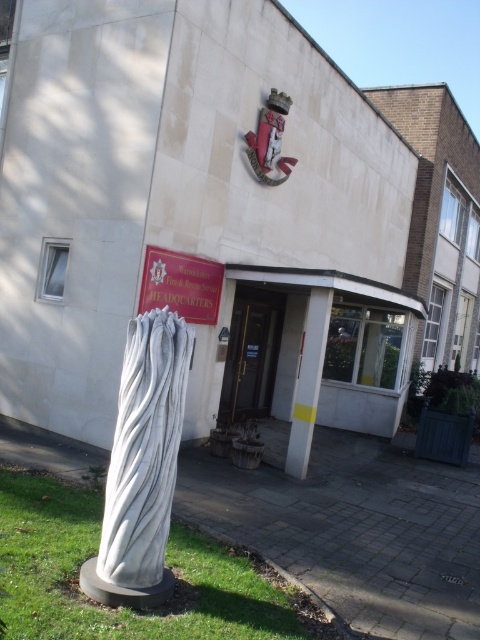
Question: Does green grass at lower left come in front of white marble pillar at center?

Choices:
 (A) yes
 (B) no

Answer: (A)

Question: Does green grass at lower left appear on the left side of white marble pillar at center?

Choices:
 (A) yes
 (B) no

Answer: (A)

Question: Among these objects, which one is nearest to the camera?

Choices:
 (A) metallic gold door at center
 (B) white marble column at lower left
 (C) green grass at lower left
 (D) white marble pillar at center

Answer: (C)

Question: Which point is closer to the camera?

Choices:
 (A) white marble column at lower left
 (B) green grass at lower left
 (C) white marble pillar at center
 (D) metallic gold door at center

Answer: (B)

Question: Does white marble column at lower left appear under metallic gold door at center?

Choices:
 (A) no
 (B) yes

Answer: (B)

Question: Which object appears closest to the camera in this image?

Choices:
 (A) white marble pillar at center
 (B) metallic gold door at center

Answer: (A)